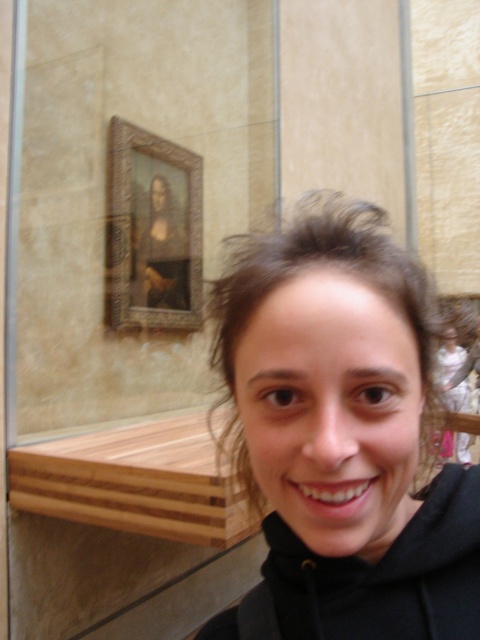
Who is positioned more to the left, matte black hoodie at center or black fleece sweatshirt at center?

matte black hoodie at center is more to the left.

Looking at this image, is matte black hoodie at center positioned behind black fleece sweatshirt at center?

That is False.

Does point (276, 404) lie behind point (459, 545)?

No, it is in front of (459, 545).

Find the location of a particular element. The height and width of the screenshot is (640, 480). matte black hoodie at center is located at coordinates (342, 436).